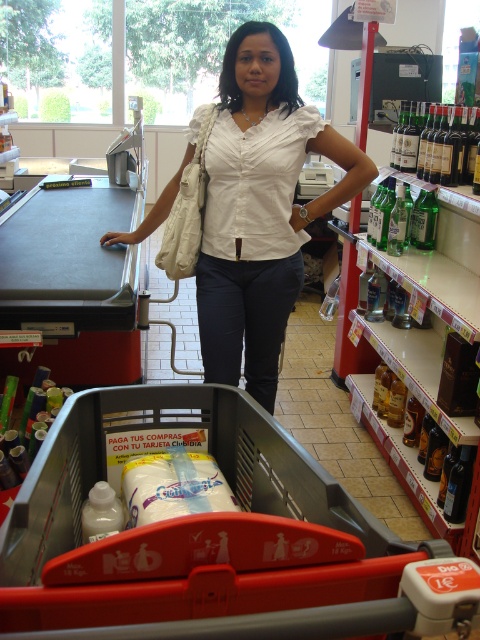
Question: Which of these objects is positioned closest to the green glass bottles at upper right?

Choices:
 (A) green glass bottles at right
 (B) red plastic shopping cart at center

Answer: (A)

Question: Observing the image, what is the correct spatial positioning of white cotton blouse at center in reference to green glass bottles at right?

Choices:
 (A) above
 (B) below

Answer: (B)

Question: Which object appears farthest from the camera in this image?

Choices:
 (A) red plastic shopping cart at center
 (B) green glass bottles at right
 (C) green glass bottles at upper right
 (D) white cotton blouse at center

Answer: (B)

Question: Can you confirm if white cotton blouse at center is positioned to the left of green glass bottles at right?

Choices:
 (A) no
 (B) yes

Answer: (B)

Question: Is the position of red plastic shopping cart at center more distant than that of white cotton blouse at center?

Choices:
 (A) no
 (B) yes

Answer: (A)

Question: Considering the real-world distances, which object is farthest from the green glass bottles at right?

Choices:
 (A) red plastic shopping cart at center
 (B) green glass bottles at upper right
 (C) white cotton blouse at center

Answer: (A)